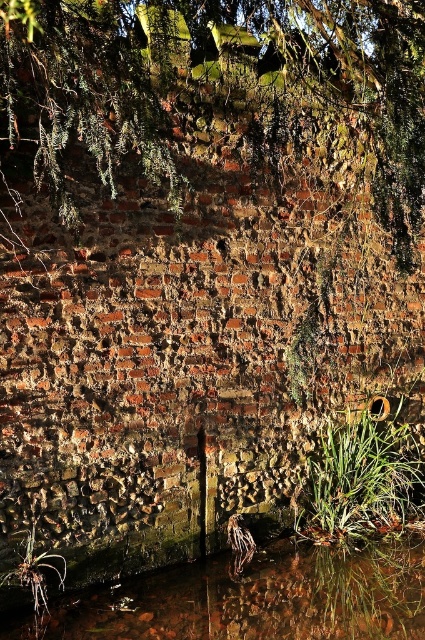
You are standing in front of a weathered brick wall with greenery. There are two points marked on the wall. One is at coordinate point [419,42] and the other at point [34,579]. Which point is closer to you?

Point [419,42] is in front of point [34,579], so it is closer to you.

You are standing in front of a weathered brick wall with greenery growing on it. There is a point at coordinates (212, 83). What is this point located on?

The point at (212, 83) is located on the green leafy tree at upper center.